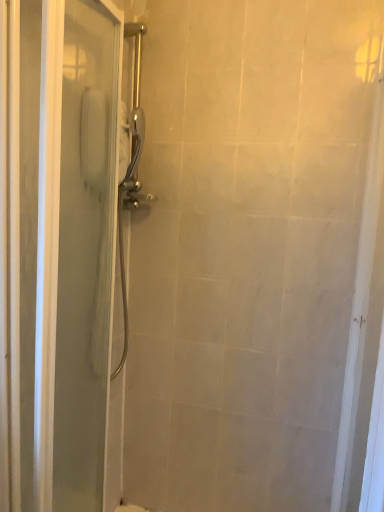
Image resolution: width=384 pixels, height=512 pixels. What do you see at coordinates (56, 250) in the screenshot? I see `transparent glass screen door at left` at bounding box center [56, 250].

The width and height of the screenshot is (384, 512). In order to click on transparent glass screen door at left in this screenshot , I will do `click(56, 250)`.

This screenshot has height=512, width=384. Find the location of `transparent glass screen door at left`. transparent glass screen door at left is located at coordinates (56, 250).